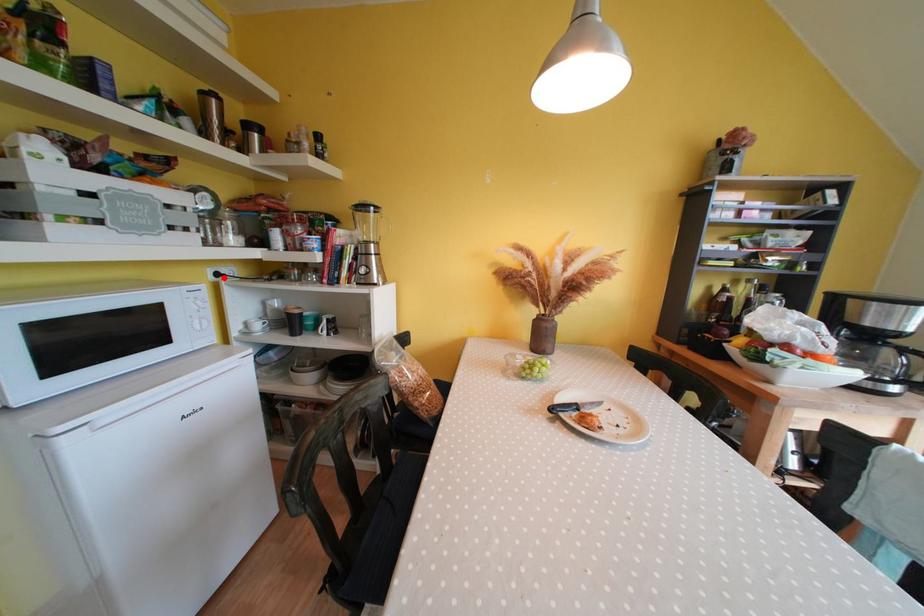
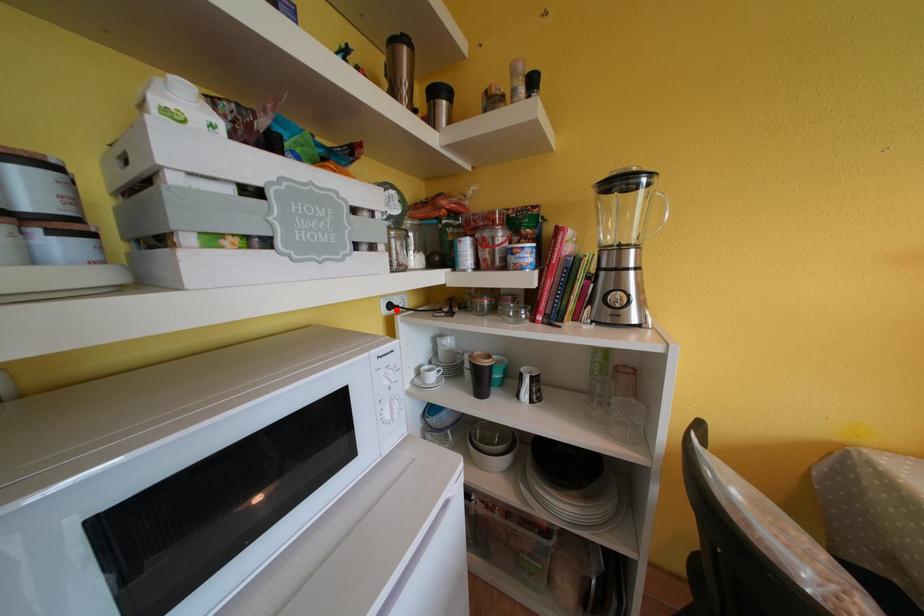
I am providing you with two images of the same scene from different viewpoints. A red point is marked on the first image and another point is marked on the second image. Do the highlighted points in image1 and image2 indicate the same real-world spot?

Yes